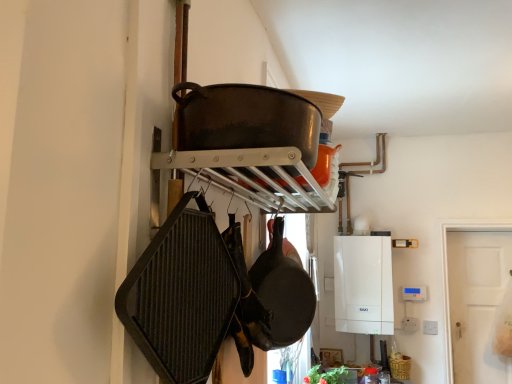
Question: Is the depth of white plastic boiler at center greater than that of dark brown cast iron wok at upper center?

Choices:
 (A) no
 (B) yes

Answer: (B)

Question: From a real-world perspective, is white plastic boiler at center located higher than dark brown cast iron wok at upper center?

Choices:
 (A) no
 (B) yes

Answer: (A)

Question: Is white plastic boiler at center bigger than dark brown cast iron wok at upper center?

Choices:
 (A) no
 (B) yes

Answer: (B)

Question: From a real-world perspective, is white plastic boiler at center below dark brown cast iron wok at upper center?

Choices:
 (A) no
 (B) yes

Answer: (B)

Question: From the image's perspective, is white plastic boiler at center below dark brown cast iron wok at upper center?

Choices:
 (A) yes
 (B) no

Answer: (A)

Question: From the image's perspective, is white plastic boiler at center above dark brown cast iron wok at upper center?

Choices:
 (A) no
 (B) yes

Answer: (A)

Question: From a real-world perspective, is dark gray textured frying pan at left, which is the 2th frying pan from back to front, on top of dark brown cast iron wok at upper center?

Choices:
 (A) no
 (B) yes

Answer: (A)

Question: Is dark gray textured frying pan at left, which is the first frying pan from front to back, with dark brown cast iron wok at upper center?

Choices:
 (A) no
 (B) yes

Answer: (A)

Question: Could you tell me if dark gray textured frying pan at left, which is the first frying pan from front to back, is facing dark brown cast iron wok at upper center?

Choices:
 (A) no
 (B) yes

Answer: (A)

Question: Is dark gray textured frying pan at left, placed as the first frying pan when sorted from left to right, shorter than dark brown cast iron wok at upper center?

Choices:
 (A) no
 (B) yes

Answer: (A)

Question: Is dark gray textured frying pan at left, which ranks as the 2th frying pan in right-to-left order, at the left side of dark brown cast iron wok at upper center?

Choices:
 (A) no
 (B) yes

Answer: (B)

Question: Considering the relative sizes of dark gray textured frying pan at left, which is the first frying pan from front to back, and dark brown cast iron wok at upper center in the image provided, is dark gray textured frying pan at left, which is the first frying pan from front to back, bigger than dark brown cast iron wok at upper center?

Choices:
 (A) yes
 (B) no

Answer: (B)

Question: Considering the relative positions of black matte frying pan at center, placed as the 1th frying pan when sorted from back to front, and dark brown cast iron wok at upper center in the image provided, is black matte frying pan at center, placed as the 1th frying pan when sorted from back to front, behind dark brown cast iron wok at upper center?

Choices:
 (A) no
 (B) yes

Answer: (B)